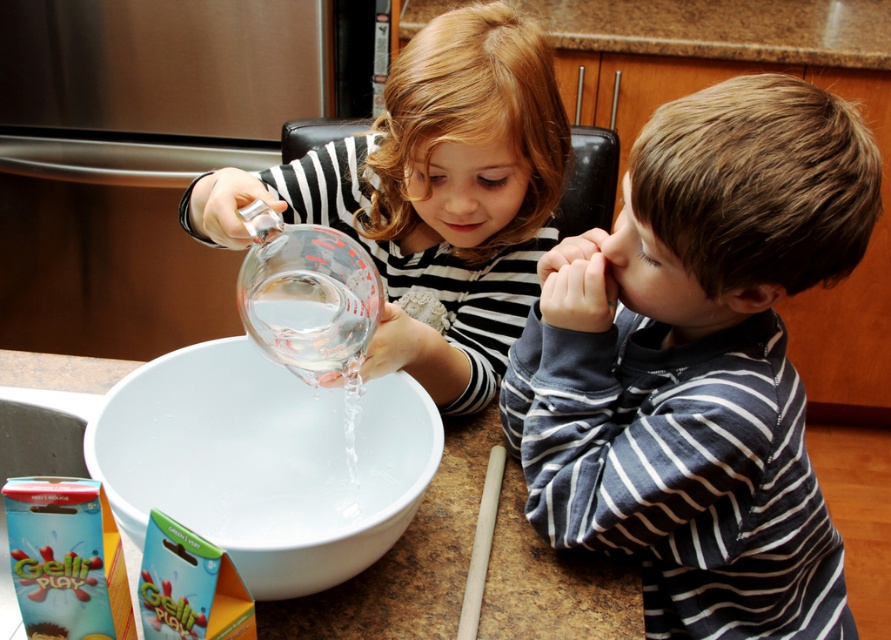
Does transparent glass measuring cup at upper center have a lesser height compared to white glossy bowl at center?

No, transparent glass measuring cup at upper center is not shorter than white glossy bowl at center.

Which of these two, transparent glass measuring cup at upper center or white glossy bowl at center, stands taller?

Standing taller between the two is transparent glass measuring cup at upper center.

Measure the distance between transparent glass measuring cup at upper center and camera.

transparent glass measuring cup at upper center is 29.17 inches from camera.

This screenshot has width=891, height=640. Find the location of `transparent glass measuring cup at upper center`. transparent glass measuring cup at upper center is located at coordinates (432, 198).

Can you confirm if dark blue striped shirt at right is wider than white glossy bowl at center?

Indeed, dark blue striped shirt at right has a greater width compared to white glossy bowl at center.

Is dark blue striped shirt at right positioned before white glossy bowl at center?

Yes, dark blue striped shirt at right is in front of white glossy bowl at center.

Between point (732, 84) and point (124, 445), which one is positioned behind?

The point (124, 445) is behind.

At what (x,y) coordinates should I click in order to perform the action: click on dark blue striped shirt at right. Please return your answer as a coordinate pair (x, y). Image resolution: width=891 pixels, height=640 pixels. Looking at the image, I should click on (699, 364).

Can you confirm if dark blue striped shirt at right is taller than transparent glass measuring cup at upper center?

Yes, dark blue striped shirt at right is taller than transparent glass measuring cup at upper center.

Does dark blue striped shirt at right appear on the left side of transparent glass measuring cup at upper center?

No, dark blue striped shirt at right is not to the left of transparent glass measuring cup at upper center.

Which is in front, point (767, 291) or point (527, 205)?

Point (767, 291) is more forward.

Locate an element on the screen. This screenshot has width=891, height=640. dark blue striped shirt at right is located at coordinates 699,364.